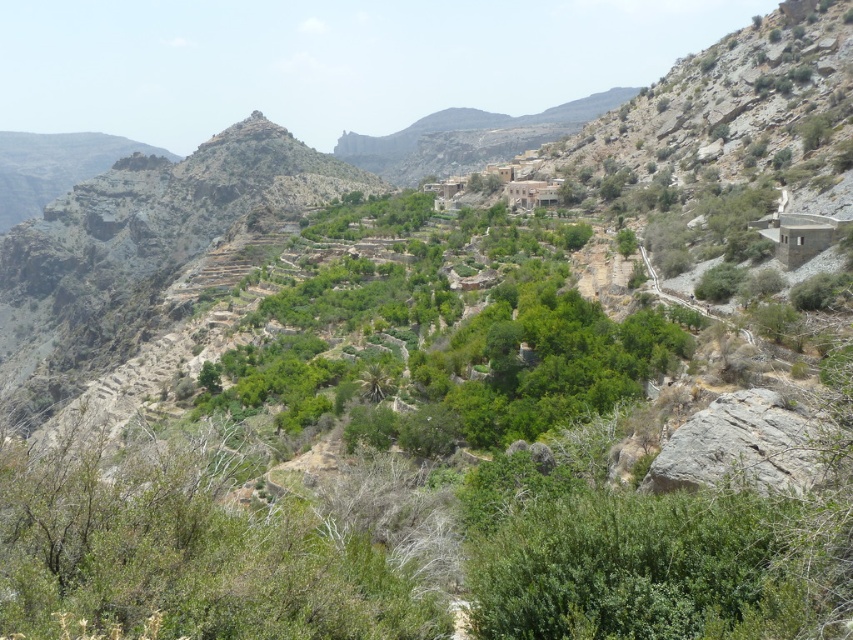
Does green leafy shrubs at center lie in front of brown stone village at upper center?

That is True.

Can you confirm if green leafy shrubs at center is wider than brown stone village at upper center?

Indeed, green leafy shrubs at center has a greater width compared to brown stone village at upper center.

Where is `green leafy shrubs at center`? This screenshot has width=853, height=640. green leafy shrubs at center is located at coordinates (451, 353).

In order to click on green leafy shrubs at center in this screenshot , I will do `click(451, 353)`.